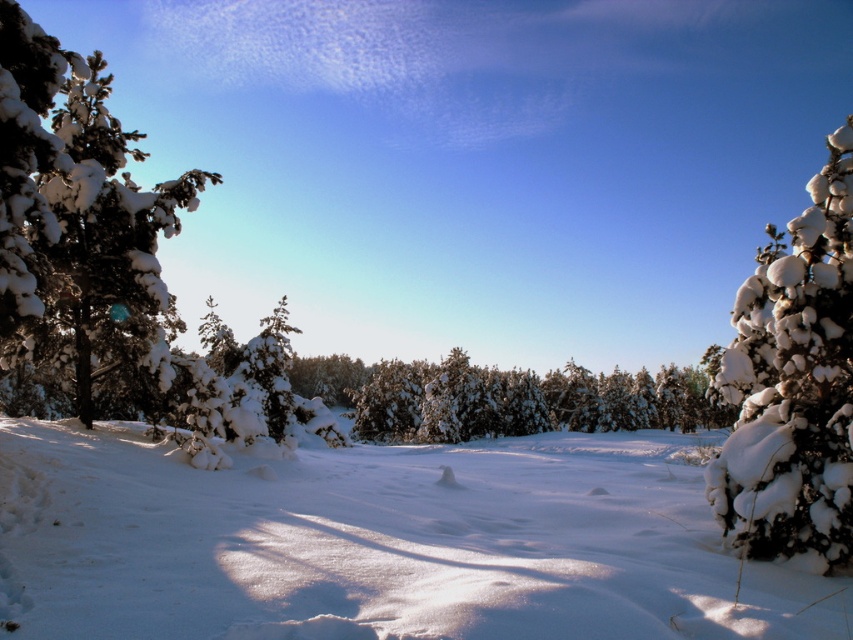
Is point (79, 218) positioned in front of point (793, 420)?

That is False.

Can you confirm if white fluffy snow-covered tree at left is thinner than snow-covered evergreen at right?

No, white fluffy snow-covered tree at left is not thinner than snow-covered evergreen at right.

Does point (74, 81) come in front of point (815, 435)?

No.

What are the coordinates of `white fluffy snow-covered tree at left` in the screenshot? It's located at (80, 232).

Which is more to the right, white fluffy snow at center or snow-covered evergreen at right?

snow-covered evergreen at right

Between white fluffy snow at center and snow-covered evergreen at right, which one is positioned higher?

Positioned higher is snow-covered evergreen at right.

Is point (368, 589) positioned before point (751, 337)?

Yes, it is.

You are a GUI agent. You are given a task and a screenshot of the screen. Output one action in this format:
    pyautogui.click(x=<x>, y=<y>)
    Task: Click on the white fluffy snow at center
    The width and height of the screenshot is (853, 640).
    Given the screenshot: What is the action you would take?
    pyautogui.click(x=380, y=544)

Between white fluffy snow at center and white fluffy snow-covered tree at left, which one is positioned lower?

white fluffy snow at center is lower down.

Is white fluffy snow at center wider than white fluffy snow-covered tree at left?

No.

You are a GUI agent. You are given a task and a screenshot of the screen. Output one action in this format:
    pyautogui.click(x=<x>, y=<y>)
    Task: Click on the white fluffy snow at center
    The image size is (853, 640).
    Given the screenshot: What is the action you would take?
    pyautogui.click(x=380, y=544)

Where is `white fluffy snow at center`? Image resolution: width=853 pixels, height=640 pixels. white fluffy snow at center is located at coordinates (380, 544).